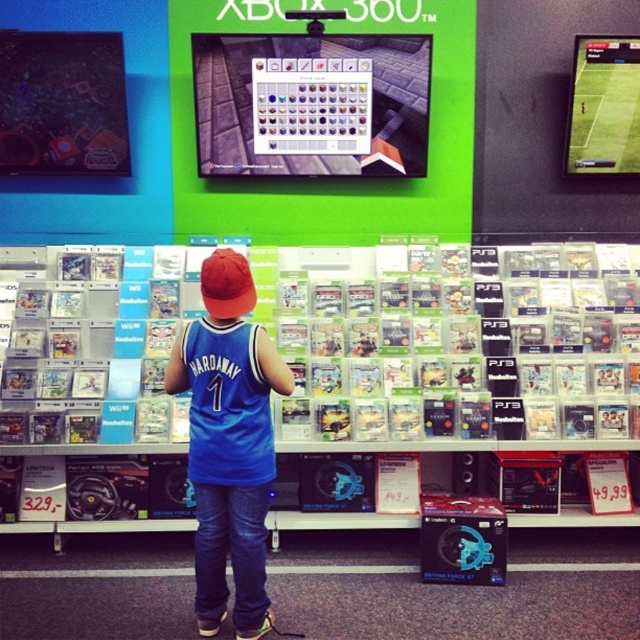
Question: Does blue jersey at center have a lesser width compared to green matte soccer game at upper center?

Choices:
 (A) no
 (B) yes

Answer: (A)

Question: Estimate the real-world distances between objects in this image. Which object is closer to the red fabric baseball cap at center?

Choices:
 (A) green matte soccer game at upper center
 (B) blue jersey at center

Answer: (B)

Question: Which point is closer to the camera taking this photo?

Choices:
 (A) (212, 253)
 (B) (212, 273)

Answer: (B)

Question: Estimate the real-world distances between objects in this image. Which object is closer to the green matte soccer game at upper center?

Choices:
 (A) red fabric baseball cap at center
 (B) blue jersey at center

Answer: (A)

Question: Can you confirm if blue jersey at center is positioned below red fabric baseball cap at center?

Choices:
 (A) yes
 (B) no

Answer: (A)

Question: Is blue jersey at center wider than green matte soccer game at upper center?

Choices:
 (A) yes
 (B) no

Answer: (A)